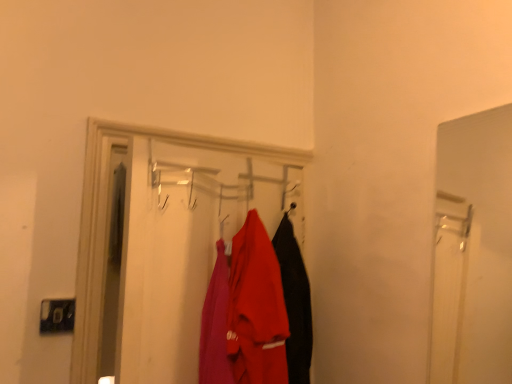
Find the location of `matte plastic coat rack at center`. matte plastic coat rack at center is located at coordinates (166, 240).

What do you see at coordinates (166, 240) in the screenshot? The width and height of the screenshot is (512, 384). I see `matte plastic coat rack at center` at bounding box center [166, 240].

The width and height of the screenshot is (512, 384). What do you see at coordinates (256, 308) in the screenshot?
I see `matte red shirt at center` at bounding box center [256, 308].

Where is `matte red shirt at center`? The height and width of the screenshot is (384, 512). matte red shirt at center is located at coordinates (256, 308).

I want to click on matte plastic coat rack at center, so click(166, 240).

Is matte red shirt at center to the left of matte plastic coat rack at center from the viewer's perspective?

Incorrect, matte red shirt at center is not on the left side of matte plastic coat rack at center.

Relative to matte plastic coat rack at center, is matte red shirt at center in front or behind?

Visually, matte red shirt at center is located behind matte plastic coat rack at center.

Considering the positions of points (261, 376) and (276, 218), is point (261, 376) closer to camera compared to point (276, 218)?

Yes.

From the image's perspective, is matte red shirt at center on matte plastic coat rack at center?

Actually, matte red shirt at center appears below matte plastic coat rack at center in the image.

From a real-world perspective, is matte red shirt at center physically located above or below matte plastic coat rack at center?

From a real-world perspective, matte red shirt at center is physically below matte plastic coat rack at center.

Considering the sizes of matte red shirt at center and matte plastic coat rack at center in the image, is matte red shirt at center wider or thinner than matte plastic coat rack at center?

Clearly, matte red shirt at center has more width compared to matte plastic coat rack at center.

Does matte red shirt at center have a greater height compared to matte plastic coat rack at center?

Incorrect, the height of matte red shirt at center is not larger of that of matte plastic coat rack at center.

Considering the sizes of objects matte red shirt at center and matte plastic coat rack at center in the image provided, who is bigger, matte red shirt at center or matte plastic coat rack at center?

matte plastic coat rack at center is bigger.

Is matte red shirt at center not within matte plastic coat rack at center?

That's incorrect, matte red shirt at center is not completely outside matte plastic coat rack at center.

Is matte red shirt at center positioned far away from matte plastic coat rack at center?

matte red shirt at center is near matte plastic coat rack at center, not far away.

Is matte red shirt at center looking in the opposite direction of matte plastic coat rack at center?

No, matte red shirt at center's orientation is not away from matte plastic coat rack at center.

How different are the orientations of matte red shirt at center and matte plastic coat rack at center in degrees?

There is a 91.8-degree angle between the facing directions of matte red shirt at center and matte plastic coat rack at center.

How much distance is there between matte red shirt at center and matte plastic coat rack at center?

They are 8.18 inches apart.

Image resolution: width=512 pixels, height=384 pixels. Find the location of `closet on the left of matte red shirt at center`. closet on the left of matte red shirt at center is located at coordinates (166, 240).

Is matte plastic coat rack at center to the left of matte red shirt at center from the viewer's perspective?

Yes.

Which is behind, matte plastic coat rack at center or matte red shirt at center?

matte red shirt at center is behind.

Considering the points (290, 182) and (271, 255), which point is behind, point (290, 182) or point (271, 255)?

The point (290, 182) is farther.

From the image's perspective, which one is positioned lower, matte plastic coat rack at center or matte red shirt at center?

From the image's view, matte red shirt at center is below.

From a real-world perspective, which is physically below, matte plastic coat rack at center or matte red shirt at center?

matte red shirt at center.

Is matte plastic coat rack at center wider than matte red shirt at center?

Incorrect, the width of matte plastic coat rack at center does not surpass that of matte red shirt at center.

From their relative heights in the image, would you say matte plastic coat rack at center is taller or shorter than matte red shirt at center?

In the image, matte plastic coat rack at center appears to be taller than matte red shirt at center.

Between matte plastic coat rack at center and matte red shirt at center, which one has larger size?

matte plastic coat rack at center is bigger.

Is matte plastic coat rack at center inside or outside of matte red shirt at center?

matte plastic coat rack at center is not enclosed by matte red shirt at center.

Would you say matte plastic coat rack at center is a long distance from matte red shirt at center?

matte plastic coat rack at center is near matte red shirt at center, not far away.

Is matte plastic coat rack at center positioned with its back to matte red shirt at center?

Yes, matte red shirt at center is at the back of matte plastic coat rack at center.

Can you tell me how much matte plastic coat rack at center and matte red shirt at center differ in facing direction?

The angular difference between matte plastic coat rack at center and matte red shirt at center is 91.8 degrees.

Locate an element on the screen. The height and width of the screenshot is (384, 512). closet that appears above the matte red shirt at center (from a real-world perspective) is located at coordinates (166, 240).

Locate an element on the screen. closet above the matte red shirt at center (from a real-world perspective) is located at coordinates (166, 240).

You are a GUI agent. You are given a task and a screenshot of the screen. Output one action in this format:
    pyautogui.click(x=<x>, y=<y>)
    Task: Click on the clothing that is below the matte plastic coat rack at center (from the image's perspective)
    The width and height of the screenshot is (512, 384).
    Given the screenshot: What is the action you would take?
    pyautogui.click(x=256, y=308)